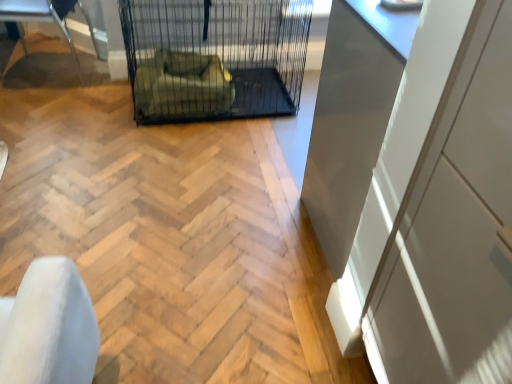
Image resolution: width=512 pixels, height=384 pixels. Describe the element at coordinates (215, 57) in the screenshot. I see `black wire mesh cage at center` at that location.

Where is `metallic silver chair at left`? This screenshot has height=384, width=512. metallic silver chair at left is located at coordinates (42, 18).

Is the position of black wire mesh cage at center more distant than that of metallic silver chair at left?

No, black wire mesh cage at center is closer to the camera.

Based on the photo, is black wire mesh cage at center wider or thinner than metallic silver chair at left?

Considering their sizes, black wire mesh cage at center looks broader than metallic silver chair at left.

I want to click on furniture behind the black wire mesh cage at center, so click(42, 18).

Is black wire mesh cage at center facing towards metallic silver chair at left?

Answer: No, black wire mesh cage at center is not turned towards metallic silver chair at left.

From the image's perspective, does white glossy cabinet at right appear lower than black wire mesh cage at center?

Yes, from the image's perspective, white glossy cabinet at right is beneath black wire mesh cage at center.

Would you say black wire mesh cage at center is part of white glossy cabinet at right's contents?

No, white glossy cabinet at right does not contain black wire mesh cage at center.

Considering the sizes of objects white glossy cabinet at right and black wire mesh cage at center in the image provided, who is smaller, white glossy cabinet at right or black wire mesh cage at center?

white glossy cabinet at right is smaller.

Is white glossy cabinet at right outside of metallic silver chair at left?

Yes, white glossy cabinet at right is outside of metallic silver chair at left.

Which object is thinner, white glossy cabinet at right or metallic silver chair at left?

With smaller width is metallic silver chair at left.

Is white glossy cabinet at right facing towards metallic silver chair at left?

No.

In the image, is white glossy cabinet at right positioned in front of or behind metallic silver chair at left?

white glossy cabinet at right is in front of metallic silver chair at left.

Is green fabric armchair at center in front of or behind metallic silver chair at left in the image?

green fabric armchair at center is in front of metallic silver chair at left.

Looking at the image, does green fabric armchair at center seem bigger or smaller compared to metallic silver chair at left?

In the image, green fabric armchair at center appears to be smaller than metallic silver chair at left.

Would you say green fabric armchair at center is inside or outside metallic silver chair at left?

green fabric armchair at center is outside metallic silver chair at left.

From the image's perspective, is green fabric armchair at center below metallic silver chair at left?

Correct, green fabric armchair at center appears lower than metallic silver chair at left in the image.

Would you consider metallic silver chair at left to be distant from white glossy cabinet at right?

Indeed, metallic silver chair at left is not near white glossy cabinet at right.

Is metallic silver chair at left completely or partially outside of white glossy cabinet at right?

Yes.

Considering the relative sizes of metallic silver chair at left and white glossy cabinet at right in the image provided, is metallic silver chair at left bigger than white glossy cabinet at right?

Actually, metallic silver chair at left might be smaller than white glossy cabinet at right.

Considering the sizes of objects green fabric armchair at center and white glossy cabinet at right in the image provided, who is smaller, green fabric armchair at center or white glossy cabinet at right?

Smaller between the two is green fabric armchair at center.

Is green fabric armchair at center inside the boundaries of white glossy cabinet at right, or outside?

green fabric armchair at center is not enclosed by white glossy cabinet at right.

At what (x,y) coordinates should I click in order to perform the action: click on armchair lying behind the white glossy cabinet at right. Please return your answer as a coordinate pair (x, y). This screenshot has height=384, width=512. Looking at the image, I should click on (182, 85).

Can you tell me how much green fabric armchair at center and white glossy cabinet at right differ in facing direction?

The facing directions of green fabric armchair at center and white glossy cabinet at right are 179 degrees apart.

Is black wire mesh cage at center in front of or behind white glossy cabinet at right in the image?

Clearly, black wire mesh cage at center is behind white glossy cabinet at right.

Are black wire mesh cage at center and white glossy cabinet at right far apart?

Yes, black wire mesh cage at center is far from white glossy cabinet at right.

Consider the image. From a real-world perspective, is black wire mesh cage at center physically located above or below white glossy cabinet at right?

black wire mesh cage at center is below white glossy cabinet at right.

At what (x,y) coordinates should I click in order to perform the action: click on bird cage in front of the metallic silver chair at left. Please return your answer as a coordinate pair (x, y). Looking at the image, I should click on (215, 57).

This screenshot has width=512, height=384. Identify the location of screen door above the black wire mesh cage at center (from a real-world perspective). pos(455,229).

From the image, which object appears to be farther from metallic silver chair at left, green fabric armchair at center or white glossy cabinet at right?

white glossy cabinet at right is further to metallic silver chair at left.

Looking at the image, which one is located closer to white glossy cabinet at right, metallic silver chair at left or black wire mesh cage at center?

black wire mesh cage at center lies closer to white glossy cabinet at right than the other object.

From the image, which object appears to be nearer to black wire mesh cage at center, white glossy cabinet at right or metallic silver chair at left?

metallic silver chair at left.

Estimate the real-world distances between objects in this image. Which object is closer to white glossy cabinet at right, metallic silver chair at left or green fabric armchair at center?

The object closer to white glossy cabinet at right is green fabric armchair at center.

Looking at the image, which one is located further to metallic silver chair at left, white glossy cabinet at right or black wire mesh cage at center?

Based on the image, white glossy cabinet at right appears to be further to metallic silver chair at left.

Based on their spatial positions, is green fabric armchair at center or metallic silver chair at left closer to white glossy cabinet at right?

green fabric armchair at center is positioned closer to the anchor white glossy cabinet at right.

Which object lies further to the anchor point green fabric armchair at center, white glossy cabinet at right or black wire mesh cage at center?

white glossy cabinet at right lies further to green fabric armchair at center than the other object.

Estimate the real-world distances between objects in this image. Which object is closer to black wire mesh cage at center, green fabric armchair at center or metallic silver chair at left?

Based on the image, green fabric armchair at center appears to be nearer to black wire mesh cage at center.

Locate an element on the screen. bird cage between white glossy cabinet at right and green fabric armchair at center along the z-axis is located at coordinates (215, 57).

Where is `bird cage between metallic silver chair at left and white glossy cabinet at right in the horizontal direction`? This screenshot has width=512, height=384. bird cage between metallic silver chair at left and white glossy cabinet at right in the horizontal direction is located at coordinates (215, 57).

Find the location of `armchair between metallic silver chair at left and black wire mesh cage at center`. armchair between metallic silver chair at left and black wire mesh cage at center is located at coordinates (182, 85).

This screenshot has height=384, width=512. I want to click on armchair situated between metallic silver chair at left and white glossy cabinet at right from left to right, so click(x=182, y=85).